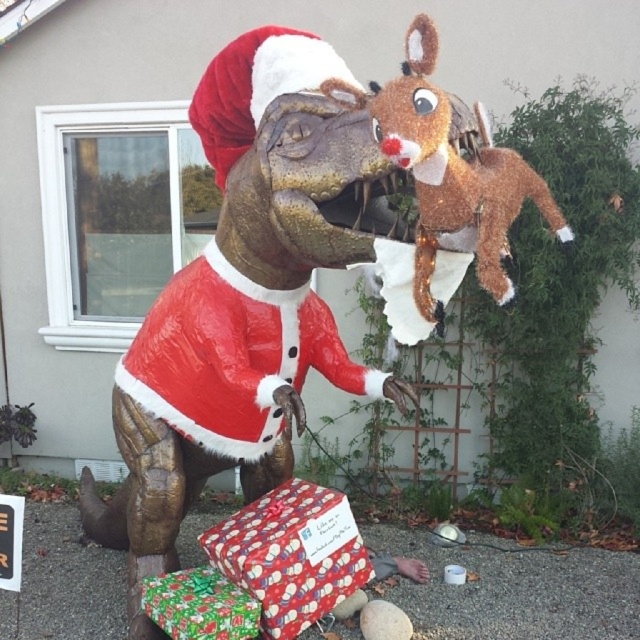
Image resolution: width=640 pixels, height=640 pixels. What do you see at coordinates (291, 554) in the screenshot? I see `wrapping paper gift at lower center` at bounding box center [291, 554].

Can you confirm if wrapping paper gift at lower center is smaller than shiny paper gift at lower center?

Incorrect, wrapping paper gift at lower center is not smaller in size than shiny paper gift at lower center.

Locate an element on the screen. This screenshot has width=640, height=640. wrapping paper gift at lower center is located at coordinates (291, 554).

Is shiny plastic dinosaur at center positioned behind wrapping paper gift at lower center?

No, it is in front of wrapping paper gift at lower center.

Where is `shiny plastic dinosaur at center`? The width and height of the screenshot is (640, 640). shiny plastic dinosaur at center is located at coordinates (243, 300).

Between point (392, 381) and point (337, 515), which one is positioned behind?

The point (337, 515) is more distant.

This screenshot has height=640, width=640. I want to click on shiny plastic dinosaur at center, so click(x=243, y=300).

At what (x,y) coordinates should I click in order to perform the action: click on shiny plastic dinosaur at center. Please return your answer as a coordinate pair (x, y). Looking at the image, I should click on [x=243, y=300].

Which is below, shiny plastic dinosaur at center or shiny paper gift at lower center?

shiny paper gift at lower center is lower down.

Which is in front, point (163, 499) or point (202, 621)?

Point (202, 621) is in front.

Find the location of a particular element. shiny plastic dinosaur at center is located at coordinates (243, 300).